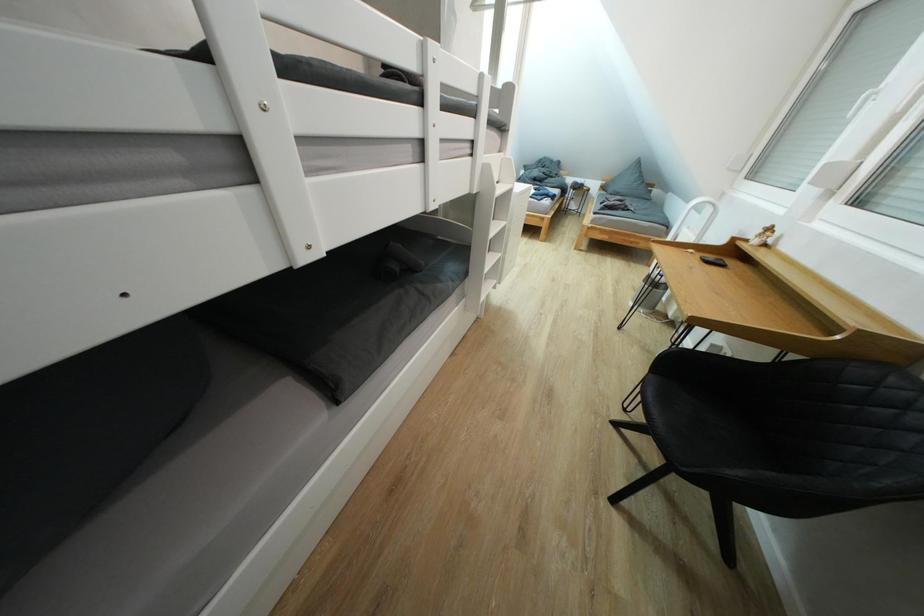
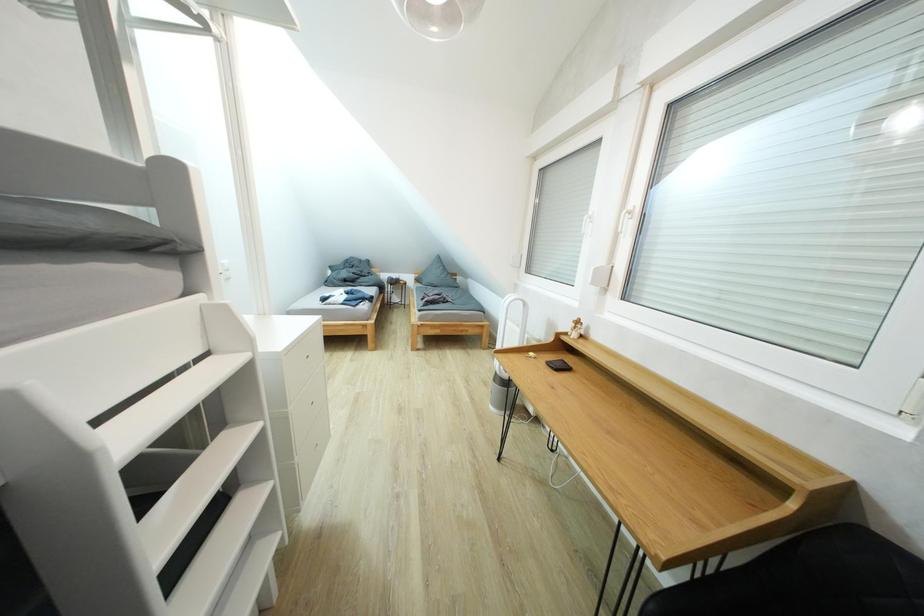
Question: How did the camera likely rotate?

Choices:
 (A) Left
 (B) Right
 (C) Up
 (D) Down

Answer: (B)